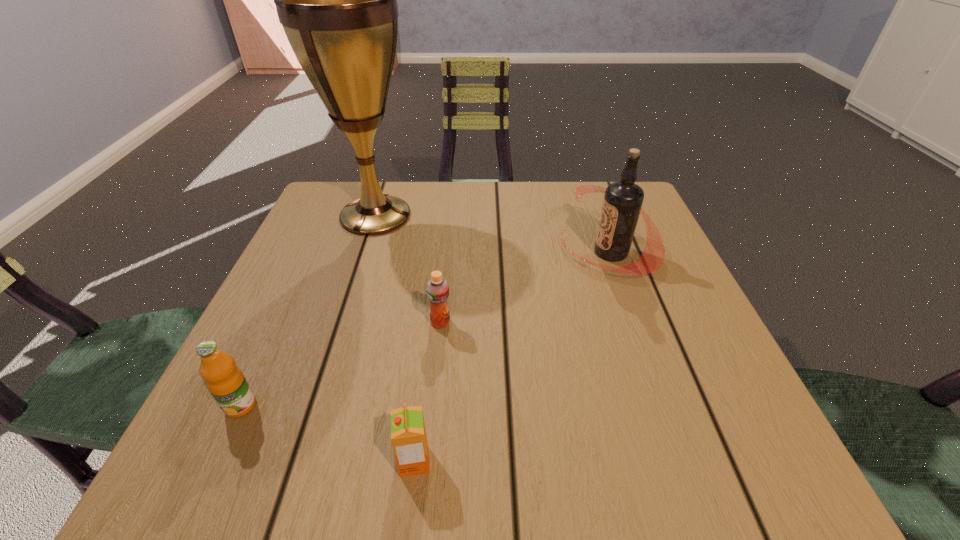
Locate an element on the screen. The image size is (960, 540). object present at the far left corner is located at coordinates (337, 0).

This screenshot has width=960, height=540. I want to click on object present at the far right corner, so click(622, 203).

The width and height of the screenshot is (960, 540). Find the location of `free space at the far edge of the desktop`. free space at the far edge of the desktop is located at coordinates (478, 191).

Where is `vacant space at the near edge`? The image size is (960, 540). vacant space at the near edge is located at coordinates (449, 440).

At what (x,y) coordinates should I click in order to perform the action: click on vacant space at the left edge of the desktop. Please return your answer as a coordinate pair (x, y). Looking at the image, I should click on pos(317,315).

Where is `vacant space at the right edge`? The width and height of the screenshot is (960, 540). vacant space at the right edge is located at coordinates (650, 284).

In the image, there is a desktop. Identify the location of free region at the far left corner. (334, 231).

Where is `vacant area at the far right corner`? The image size is (960, 540). vacant area at the far right corner is located at coordinates (570, 185).

Locate an element on the screen. The image size is (960, 540). vacant space at the near right corner of the desktop is located at coordinates (690, 480).

Identify the location of vacant space in between the tallest object and the nearest orange juice. (395, 339).